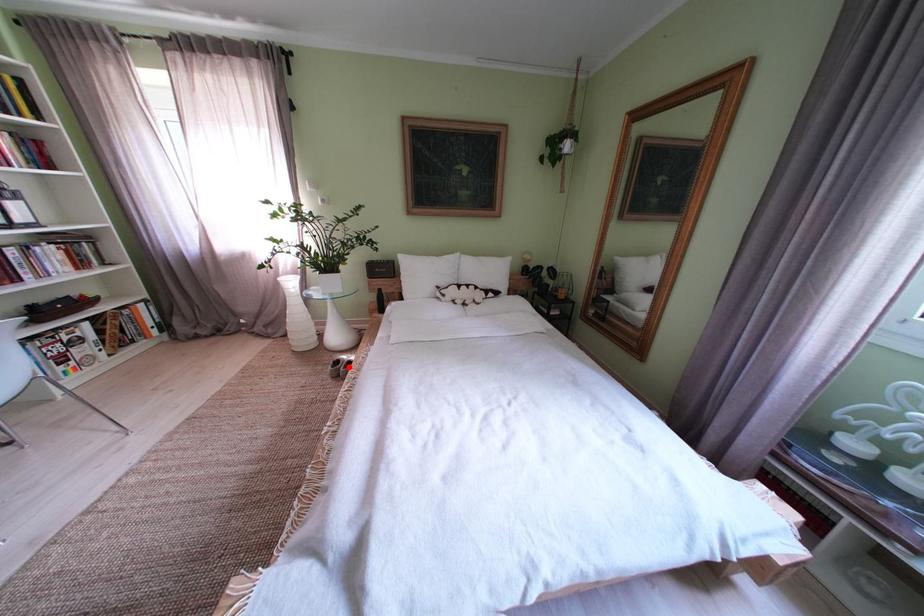
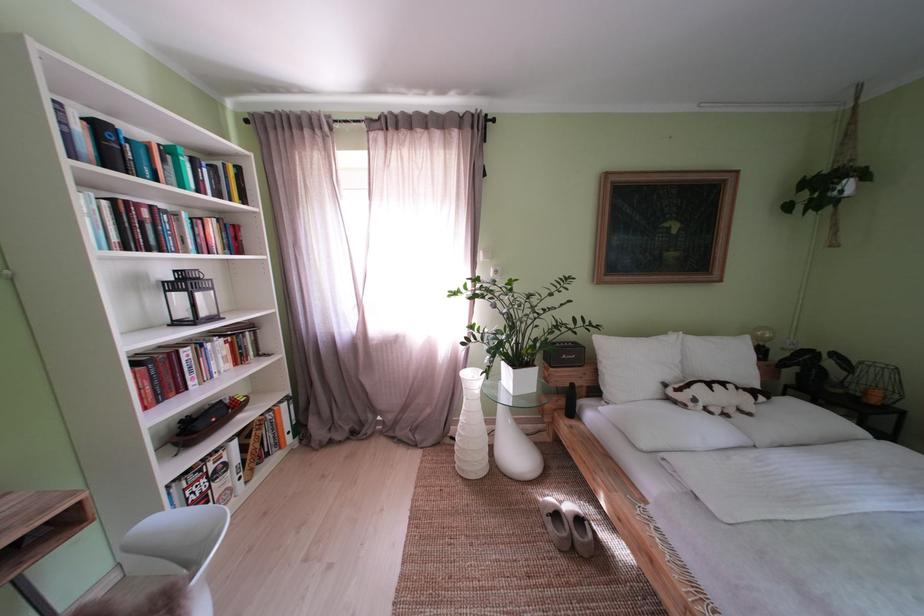
In the second image, find the point that corresponds to the highlighted location in the first image.

(567, 521)